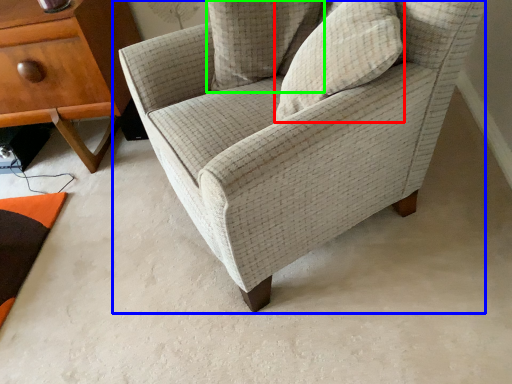
Question: Based on their relative distances, which object is farther from pillow (highlighted by a red box)? Choose from chair (highlighted by a blue box) and pillow (highlighted by a green box).

Choices:
 (A) chair
 (B) pillow

Answer: (B)